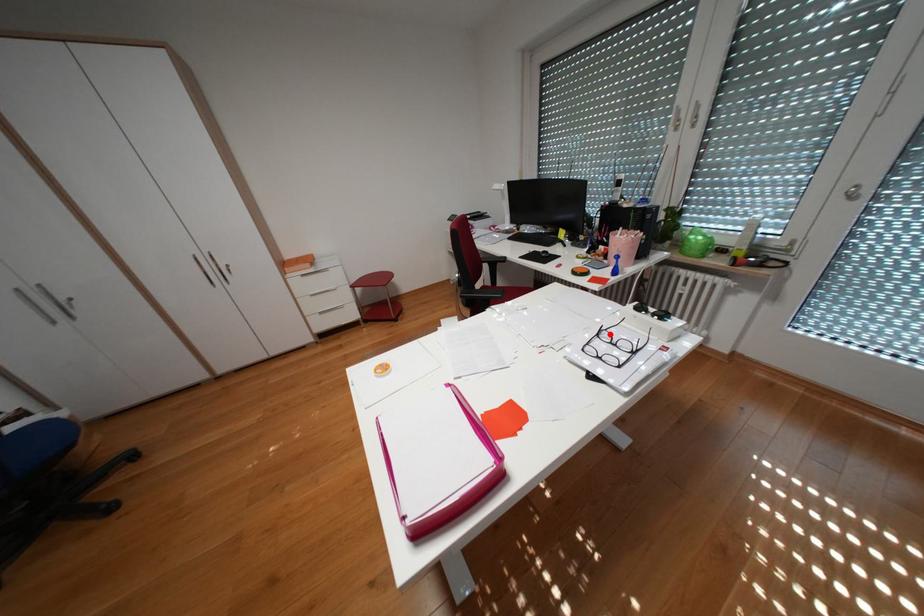
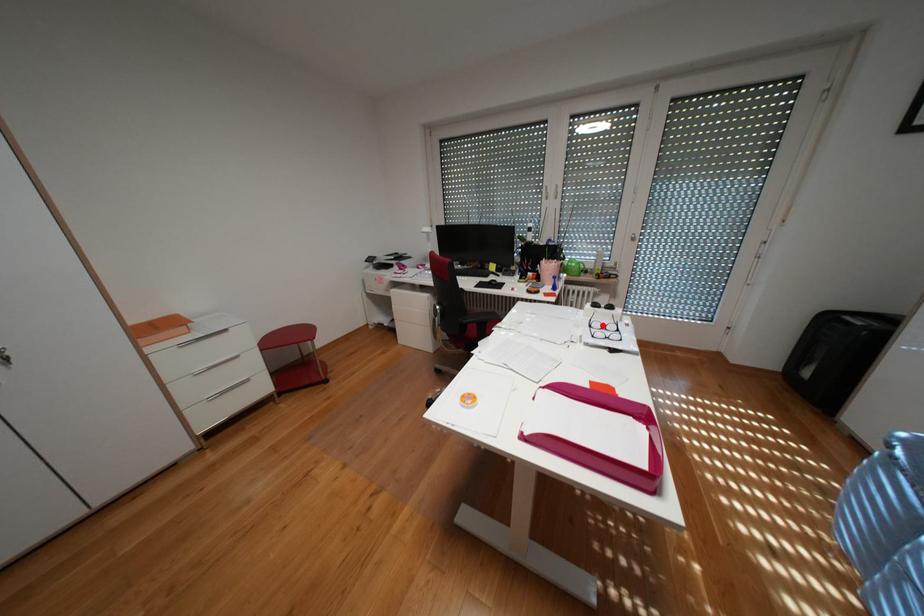
I am providing you with two images of the same scene from different viewpoints. A red point is marked on the first image and another point is marked on the second image. Is the red point in image1 aligned with the point shown in image2?

Yes